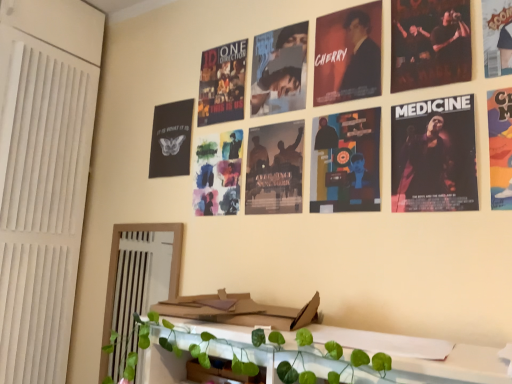
Question: Is point (302, 319) positioned closer to the camera than point (335, 46)?

Choices:
 (A) farther
 (B) closer

Answer: (B)

Question: From the image's perspective, is cardboard magazine at center above or below dark matte poster at upper center, the 3th poster in the left-to-right sequence?

Choices:
 (A) above
 (B) below

Answer: (B)

Question: Which object is the farthest from the matte paper poster at center, acting as the first poster starting from the left?

Choices:
 (A) cardboard magazine at center
 (B) matte black poster at upper right, arranged as the 3th poster when viewed from the right
 (C) colorful paper poster at upper right, arranged as the fifth poster when viewed from the left
 (D) dark matte poster at upper center, the 3th poster in the left-to-right sequence
 (E) cartoon character poster at upper right, which ranks as the first poster in right-to-left order

Answer: (E)

Question: Based on their relative distances, which object is nearer to the cartoon character poster at upper right, which ranks as the first poster in right-to-left order?

Choices:
 (A) cardboard magazine at center
 (B) matte paper poster at center, acting as the first poster starting from the left
 (C) matte black poster at center, positioned as the fifth poster in right-to-left order
 (D) dark matte poster at upper center, the fourth poster from the right
 (E) matte black poster at upper right, arranged as the 3th poster when viewed from the right

Answer: (E)